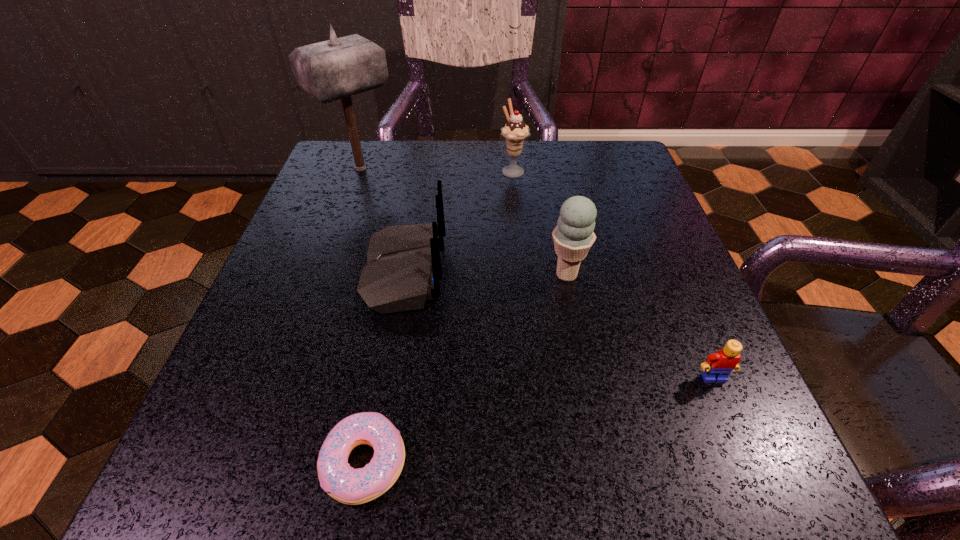
Identify the location of router present at the left edge. This screenshot has width=960, height=540. (403, 268).

Image resolution: width=960 pixels, height=540 pixels. Find the location of `object positioned at the right edge`. object positioned at the right edge is located at coordinates (718, 366).

You are a GUI agent. You are given a task and a screenshot of the screen. Output one action in this format:
    pyautogui.click(x=<x>, y=<y>)
    Task: Click on the object situated at the far left corner
    This screenshot has width=960, height=540.
    Given the screenshot: What is the action you would take?
    pyautogui.click(x=338, y=68)

Where is `vacant space at the far edge`? This screenshot has height=540, width=960. vacant space at the far edge is located at coordinates (505, 148).

In the image, there is a desktop. Identify the location of vacant space at the near edge. (573, 464).

Locate an element on the screen. The width and height of the screenshot is (960, 540). free space at the left edge of the desktop is located at coordinates (276, 339).

Find the location of a particular element. Image resolution: width=960 pixels, height=540 pixels. vacant area at the right edge of the desktop is located at coordinates (649, 209).

The width and height of the screenshot is (960, 540). In order to click on free location at the far left corner in this screenshot , I will do `click(395, 149)`.

The height and width of the screenshot is (540, 960). In the image, there is a desktop. In order to click on vacant area at the far right corner in this screenshot , I will do `click(574, 141)`.

You are a GUI agent. You are given a task and a screenshot of the screen. Output one action in this format:
    pyautogui.click(x=<x>, y=<y>)
    Task: Click on the vacant space at the near right corner of the desktop
    
    Given the screenshot: What is the action you would take?
    pyautogui.click(x=682, y=490)